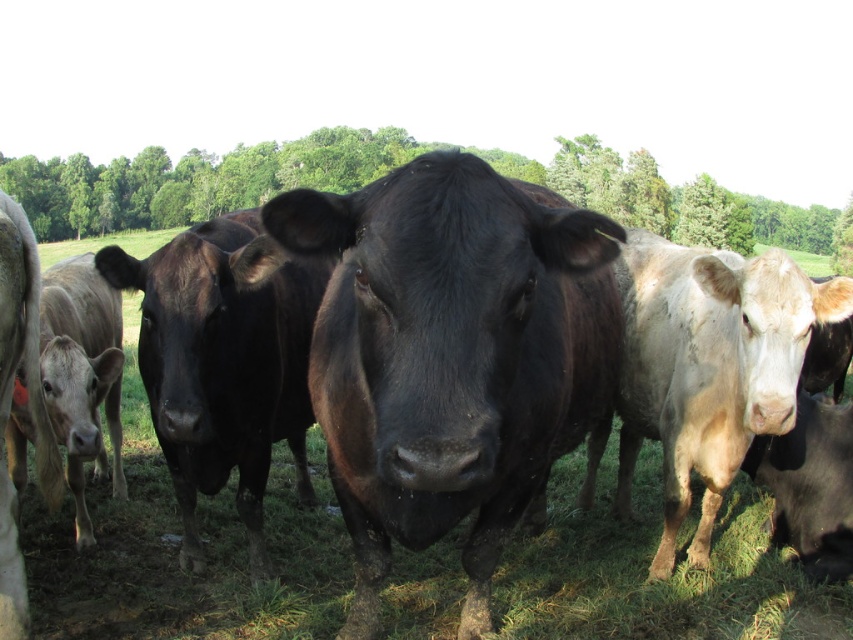
Question: Which object is closer to the camera taking this photo?

Choices:
 (A) shiny black bull at center
 (B) black glossy cow at lower right

Answer: (A)

Question: Which object is farther from the camera taking this photo?

Choices:
 (A) black glossy bull at center
 (B) black glossy cow at lower right

Answer: (B)

Question: Can you confirm if black glossy bull at center is smaller than shiny black bull at center?

Choices:
 (A) yes
 (B) no

Answer: (A)

Question: Which of these objects is positioned closest to the light brown smooth calf at left?

Choices:
 (A) shiny black bull at center
 (B) shiny black cow at left

Answer: (A)

Question: Where is shiny black bull at center located in relation to shiny black cow at left in the image?

Choices:
 (A) right
 (B) left

Answer: (A)

Question: Is shiny black bull at center smaller than black glossy cow at lower right?

Choices:
 (A) yes
 (B) no

Answer: (B)